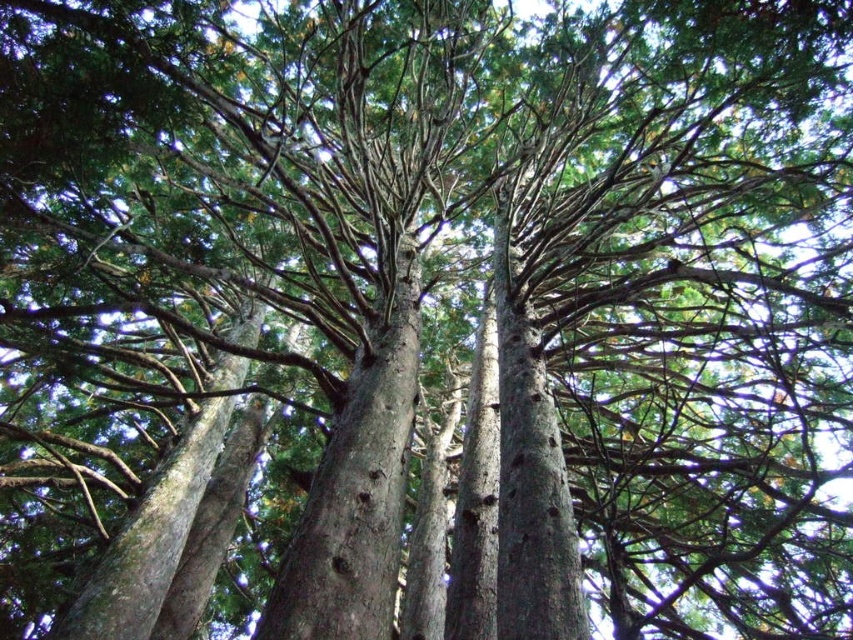
You are a hiker who wants to identify the tree with the largest visible bark area in the forest scene. Which one between the smooth bark tree trunk at center and the smooth gray bark at center should you choose?

The smooth gray bark at center occupies more space than the smooth bark tree trunk at center, so you should choose the smooth gray bark at center.

You are standing in the forest and looking up at the trees. You notice a smooth bark tree trunk at center. Can you tell me the exact coordinates where you see it?

The smooth bark tree trunk at center is located at coordinates point (357,486).

You are a researcher studying tree structures in this forest. You notice two features at the center of your view. One is the smooth bark tree trunk at center, and the other is the smooth gray bark at center. Which of these two features is taller?

The smooth bark tree trunk at center is much taller than the smooth gray bark at center.